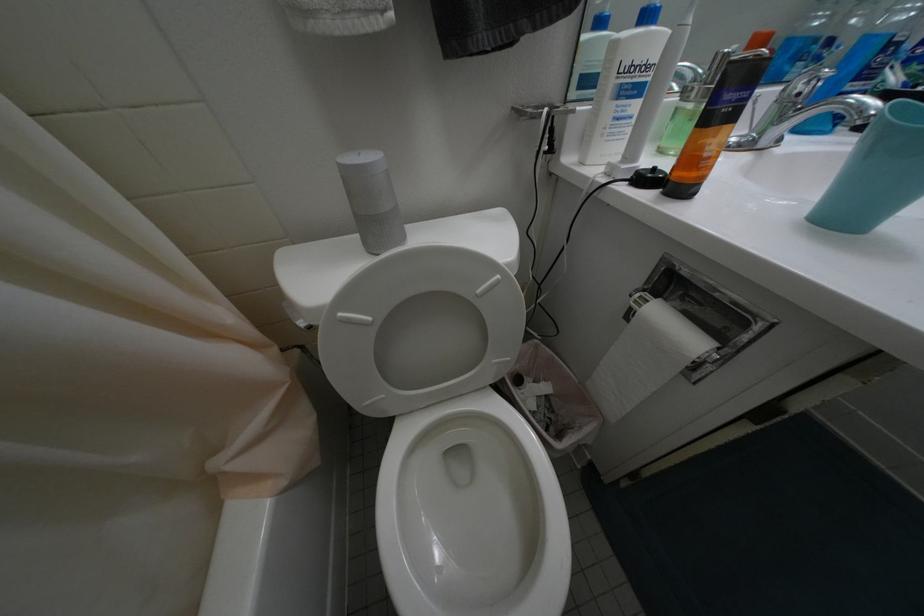
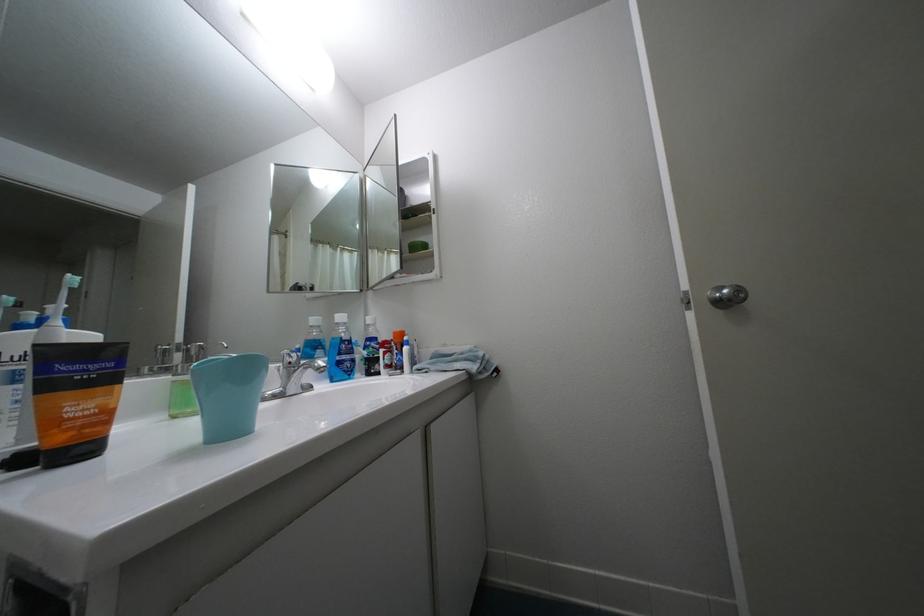
First-person continuous shooting, in which direction is the camera rotating?

The camera rotated toward right-up.